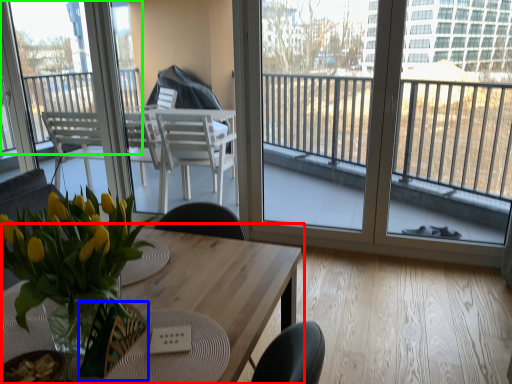
Question: Which is nearer to the table (highlighted by a red box)? armchair (highlighted by a blue box) or window (highlighted by a green box).

Choices:
 (A) armchair
 (B) window

Answer: (A)